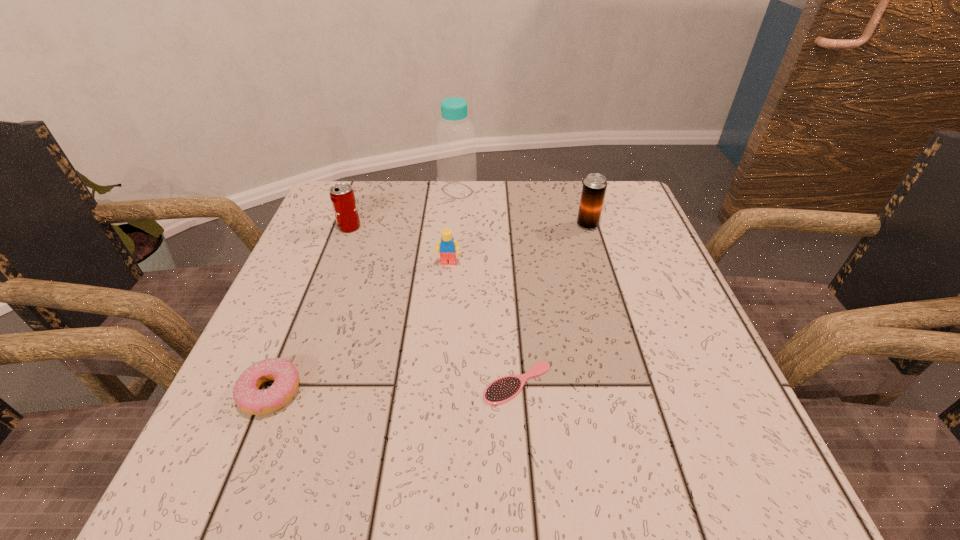
Where is `bottle`? This screenshot has height=540, width=960. bottle is located at coordinates (455, 146).

You are a GUI agent. You are given a task and a screenshot of the screen. Output one action in this format:
    pyautogui.click(x=<x>, y=<y>)
    Task: Click on the tallest object
    
    Given the screenshot: What is the action you would take?
    pyautogui.click(x=455, y=146)

What are the coordinates of `the fifth shortest object` in the screenshot? It's located at (594, 188).

Identify the location of the right beer can. (594, 188).

The height and width of the screenshot is (540, 960). In order to click on the left beer can in this screenshot , I will do `click(342, 196)`.

At what (x,y) coordinates should I click in order to perform the action: click on the fourth shortest object. Please return your answer as a coordinate pair (x, y). This screenshot has height=540, width=960. Looking at the image, I should click on pos(342,196).

Where is `Lego`? Lego is located at coordinates (447, 246).

This screenshot has height=540, width=960. Identify the location of the third shortest object. (447, 246).

In order to click on doughnut in this screenshot , I will do `click(249, 398)`.

You are a GUI agent. You are given a task and a screenshot of the screen. Output one action in this format:
    pyautogui.click(x=<x>, y=<y>)
    Task: Click on the hairbrush
    This screenshot has height=540, width=960.
    Given the screenshot: What is the action you would take?
    pyautogui.click(x=504, y=389)